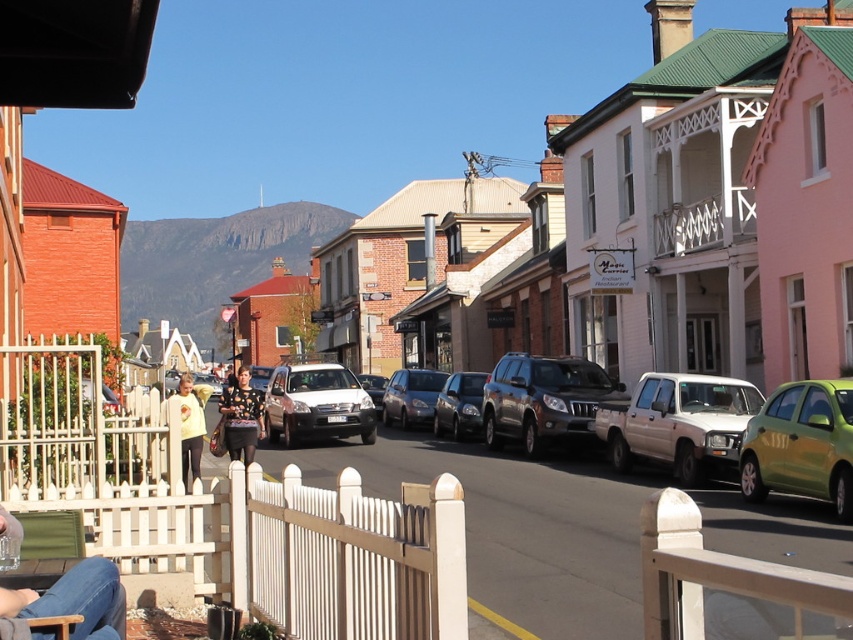
Question: Does white matte truck at center appear on the left side of green matte car at right?

Choices:
 (A) yes
 (B) no

Answer: (A)

Question: In this image, where is white matte car at center located relative to floral-patterned top at center?

Choices:
 (A) right
 (B) left

Answer: (A)

Question: Among these points, which one is nearest to the camera?

Choices:
 (A) (776, 426)
 (B) (316, 387)

Answer: (A)

Question: Based on their relative distances, which object is nearer to the green matte car at right?

Choices:
 (A) satin silver sedan at center
 (B) white matte car at center

Answer: (B)

Question: Which point is closer to the camera taking this photo?

Choices:
 (A) (759, 392)
 (B) (183, 452)
 (C) (809, 472)

Answer: (C)

Question: Can you confirm if white matte truck at center is positioned above shiny black suv at center?

Choices:
 (A) yes
 (B) no

Answer: (B)